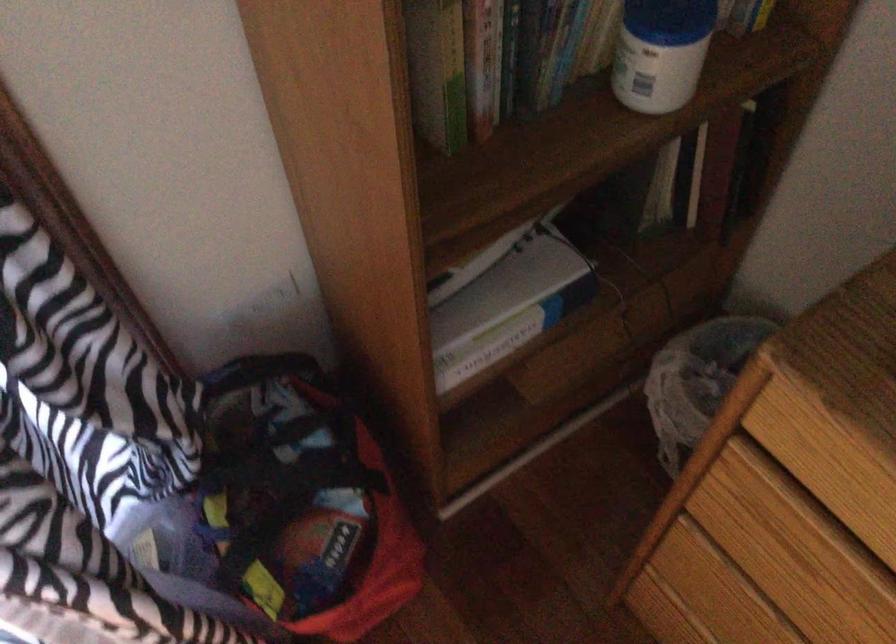
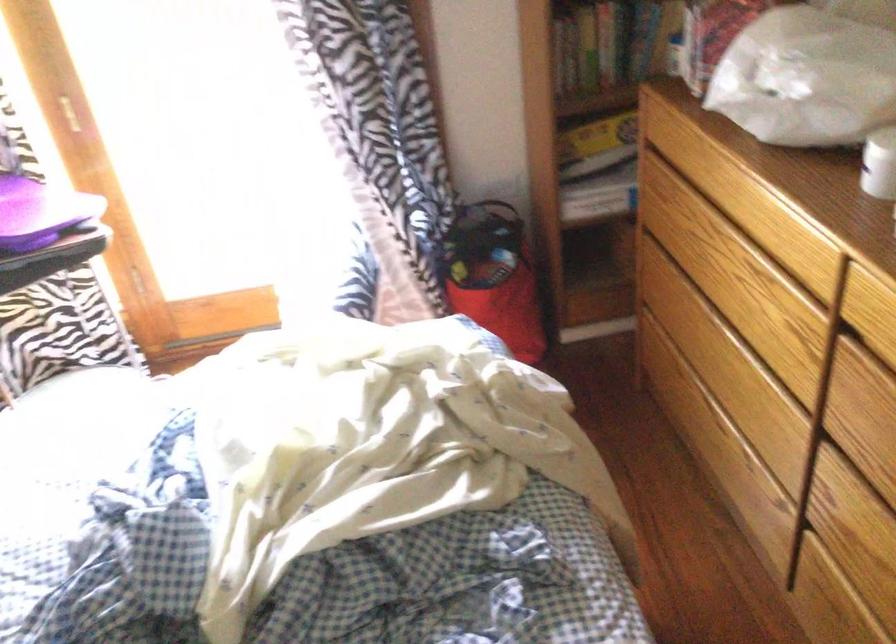
Locate, in the second image, the point that corresponds to (403,138) in the first image.

(564, 58)